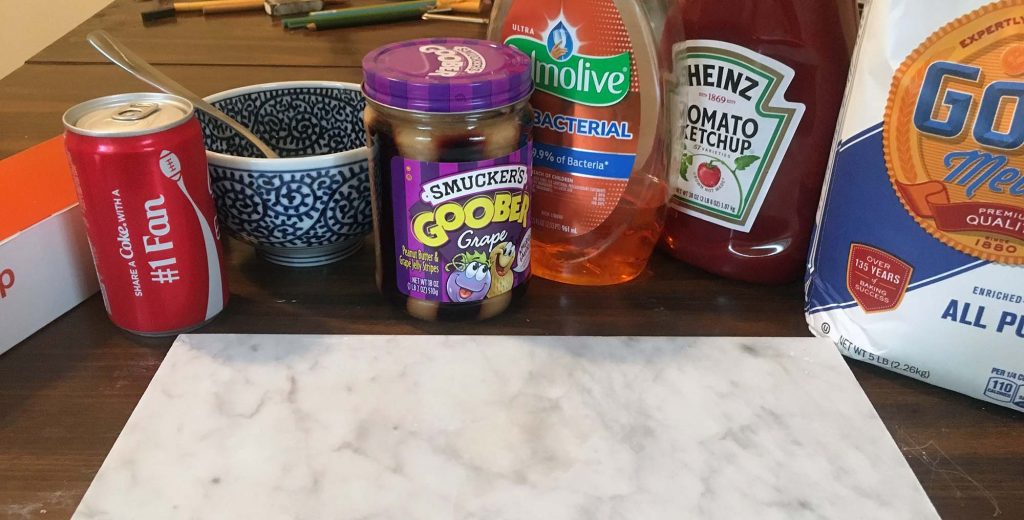
The image size is (1024, 520). Identify the location of bottle. (772, 211).